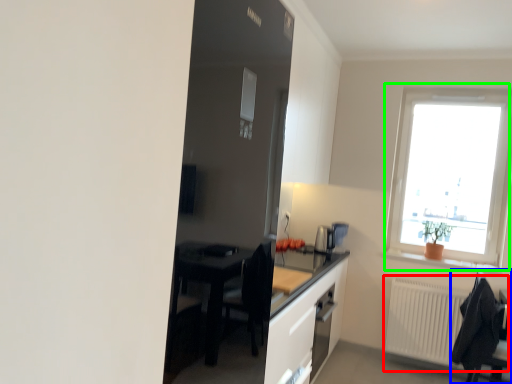
Question: Which is nearer to the radiator (highlighted by a red box)? chair (highlighted by a blue box) or window (highlighted by a green box).

Choices:
 (A) chair
 (B) window

Answer: (A)